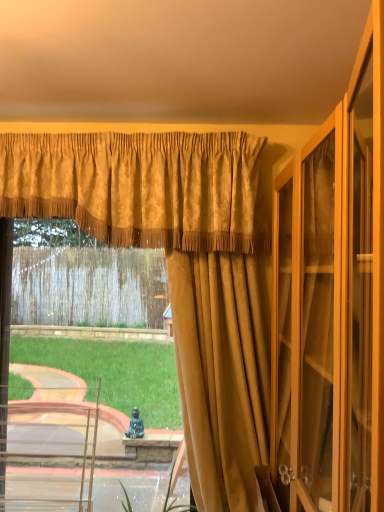
Question: In which direction should I rotate to look at gold textured curtain at center, arranged as the third curtain when viewed from the front?

Choices:
 (A) right
 (B) left

Answer: (B)

Question: Is suede-like gold curtain at center, which appears as the third curtain when viewed from the back, to the left of gold textured valance at upper center, which ranks as the 2th curtain in front-to-back order, from the viewer's perspective?

Choices:
 (A) yes
 (B) no

Answer: (B)

Question: Is suede-like gold curtain at center, which appears as the third curtain when viewed from the back, far from gold textured valance at upper center, which is the 2th curtain in back-to-front order?

Choices:
 (A) no
 (B) yes

Answer: (A)

Question: Can you confirm if suede-like gold curtain at center, the first curtain viewed from the front, is positioned to the right of gold textured valance at upper center, which is the 2th curtain in back-to-front order?

Choices:
 (A) no
 (B) yes

Answer: (B)

Question: Is suede-like gold curtain at center, the first curtain viewed from the front, positioned behind gold textured valance at upper center, which ranks as the 2th curtain in front-to-back order?

Choices:
 (A) yes
 (B) no

Answer: (B)

Question: Does suede-like gold curtain at center, which appears as the third curtain when viewed from the back, have a lesser height compared to gold textured valance at upper center, which ranks as the 2th curtain in front-to-back order?

Choices:
 (A) no
 (B) yes

Answer: (A)

Question: Could you tell me if suede-like gold curtain at center, the first curtain viewed from the front, is turned towards gold textured valance at upper center, which is the 2th curtain in back-to-front order?

Choices:
 (A) yes
 (B) no

Answer: (B)

Question: Considering the relative sizes of suede-like gold curtain at center, the first curtain viewed from the front, and gold textured curtain at center, positioned as the 1th curtain in back-to-front order, in the image provided, is suede-like gold curtain at center, the first curtain viewed from the front, taller than gold textured curtain at center, positioned as the 1th curtain in back-to-front order,?

Choices:
 (A) yes
 (B) no

Answer: (A)

Question: Can gold textured curtain at center, positioned as the 1th curtain in back-to-front order, be found inside suede-like gold curtain at center, which appears as the third curtain when viewed from the back?

Choices:
 (A) no
 (B) yes

Answer: (A)

Question: Is suede-like gold curtain at center, the first curtain viewed from the front, at the right side of gold textured curtain at center, positioned as the 1th curtain in back-to-front order?

Choices:
 (A) yes
 (B) no

Answer: (A)

Question: Are suede-like gold curtain at center, the first curtain viewed from the front, and gold textured curtain at center, positioned as the 1th curtain in back-to-front order, located far from each other?

Choices:
 (A) no
 (B) yes

Answer: (A)

Question: Can you confirm if suede-like gold curtain at center, the first curtain viewed from the front, is bigger than gold textured curtain at center, positioned as the 1th curtain in back-to-front order?

Choices:
 (A) no
 (B) yes

Answer: (A)

Question: Considering the relative sizes of suede-like gold curtain at center, which appears as the third curtain when viewed from the back, and gold textured curtain at center, positioned as the 1th curtain in back-to-front order, in the image provided, is suede-like gold curtain at center, which appears as the third curtain when viewed from the back, thinner than gold textured curtain at center, positioned as the 1th curtain in back-to-front order,?

Choices:
 (A) yes
 (B) no

Answer: (B)

Question: From a real-world perspective, is gold textured valance at upper center, which is the 2th curtain in back-to-front order, physically above gold textured curtain at center, positioned as the 1th curtain in back-to-front order?

Choices:
 (A) no
 (B) yes

Answer: (B)